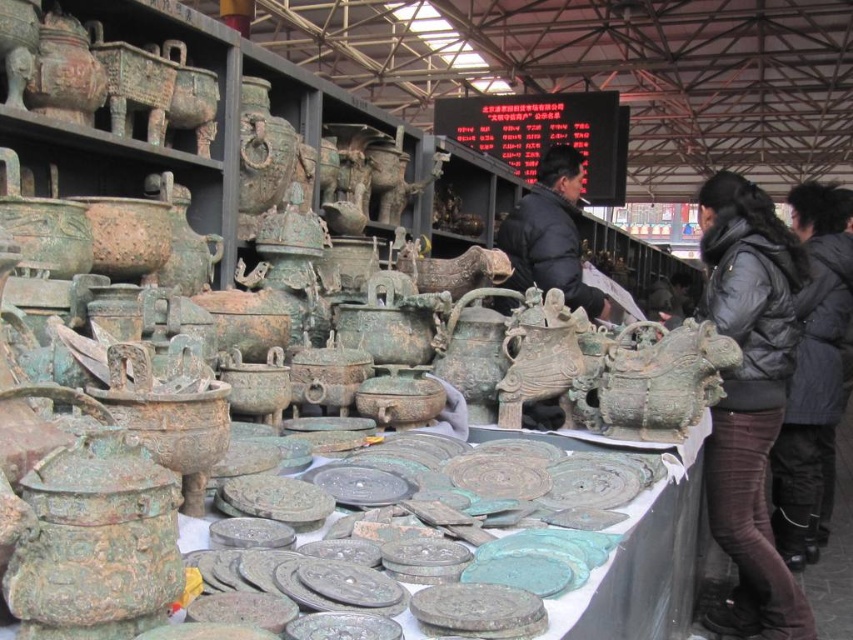
Is black puffy jacket at right taller than black matte jacket at center?

Yes.

Which is more to the right, black puffy jacket at right or black matte jacket at center?

black puffy jacket at right is more to the right.

Locate an element on the screen. black puffy jacket at right is located at coordinates (811, 369).

Is dark gray puffy jacket at right below black puffy jacket at right?

Indeed, dark gray puffy jacket at right is positioned under black puffy jacket at right.

Can you confirm if dark gray puffy jacket at right is positioned above black puffy jacket at right?

Actually, dark gray puffy jacket at right is below black puffy jacket at right.

Does point (796, 593) come in front of point (820, 227)?

That is True.

The image size is (853, 640). I want to click on dark gray puffy jacket at right, so (x=749, y=397).

Which is more to the left, dark gray puffy jacket at right or black matte jacket at center?

black matte jacket at center is more to the left.

Which is above, dark gray puffy jacket at right or black matte jacket at center?

black matte jacket at center is higher up.

Is point (805, 627) positioned in front of point (578, 273)?

That is True.

The image size is (853, 640). What are the coordinates of `dark gray puffy jacket at right` in the screenshot? It's located at (749, 397).